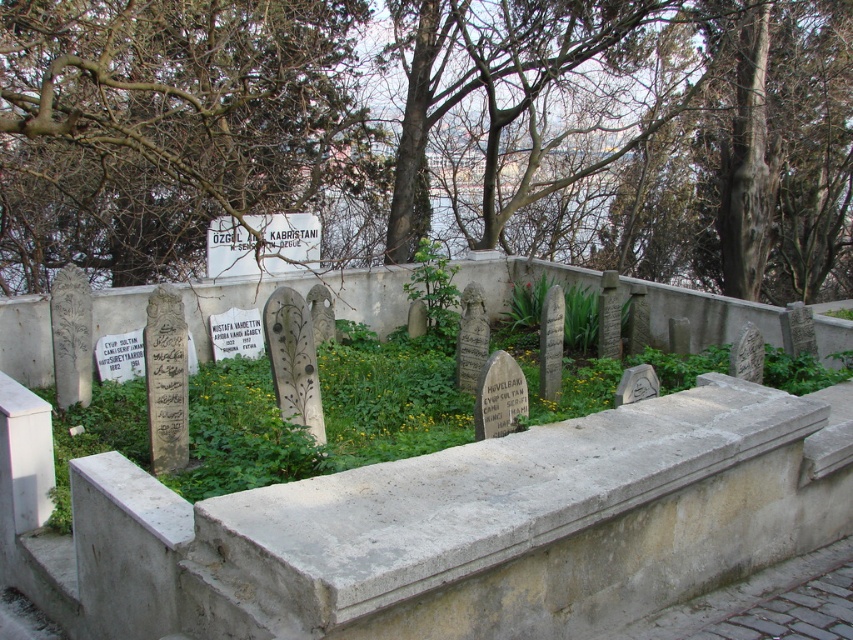
You are standing in the cemetery and notice the brown leafless tree at upper center and the bare branches at upper center. Which of these two has a bigger size?

The brown leafless tree at upper center has a larger size compared to the bare branches at upper center.

Looking at this image, you are standing at the base of the tree with bare branches at upper center in the cemetery scene. You want to take a photo of the tombstones using a camera that has a focal length of 50mm. Considering the distance between you and the branches, will the branches appear larger or smaller in the photo compared to their actual size?

The bare branches at upper center are 15.16 feet away from the camera. At a 50mm focal length, objects at this distance will appear smaller than their actual size in the photo because the focal length determines the angle of view, and 50mm is considered a standard lens that doesn photography at a perspective similar to human vision. Since the branches are relatively far away, they will appear smaller in the image compared to closer objects but not as magnified as with a telephoto lens.

You are a landscape architect designing a walking path through the cemetery. The path must pass between the brown leafless tree at upper center and the green leafy plant at center. What is the minimum width the path should be to ensure it comfortably accommodates a standard wheelchair with a width of 0.8 meters?

The distance between the brown leafless tree at upper center and the green leafy plant at center is 2.88 meters. Since the wheelchair requires 0.8 meters, the path can comfortably accommodate it as 2.88 meters is wider than 0.8 meters.